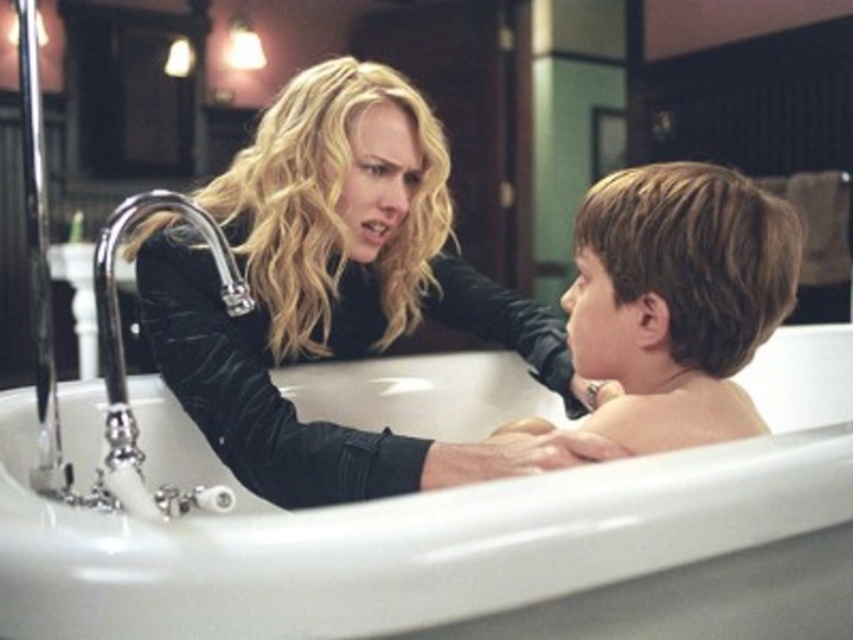
Between white glossy bathtub at center and velvet black jacket at upper left, which one has less height?

Standing shorter between the two is white glossy bathtub at center.

Does white glossy bathtub at center have a lesser width compared to velvet black jacket at upper left?

Incorrect, white glossy bathtub at center's width is not less than velvet black jacket at upper left's.

Measure the distance between white glossy bathtub at center and camera.

They are 21.12 inches apart.

Where is `white glossy bathtub at center`? The height and width of the screenshot is (640, 853). white glossy bathtub at center is located at coordinates (416, 525).

Between velvet black jacket at upper left and smooth brown hair at right, which one is positioned higher?

velvet black jacket at upper left

Between point (254, 220) and point (645, 262), which one is positioned behind?

The point (254, 220) is more distant.

Where is `velvet black jacket at upper left`? Image resolution: width=853 pixels, height=640 pixels. velvet black jacket at upper left is located at coordinates (335, 292).

Measure the distance from velvet black jacket at upper left to polished chrome faucet at left.

A distance of 24.57 centimeters exists between velvet black jacket at upper left and polished chrome faucet at left.

You are a GUI agent. You are given a task and a screenshot of the screen. Output one action in this format:
    pyautogui.click(x=<x>, y=<y>)
    Task: Click on the velvet black jacket at upper left
    
    Given the screenshot: What is the action you would take?
    pyautogui.click(x=335, y=292)

At what (x,y) coordinates should I click in order to perform the action: click on velvet black jacket at upper left. Please return your answer as a coordinate pair (x, y). The image size is (853, 640). Looking at the image, I should click on (335, 292).